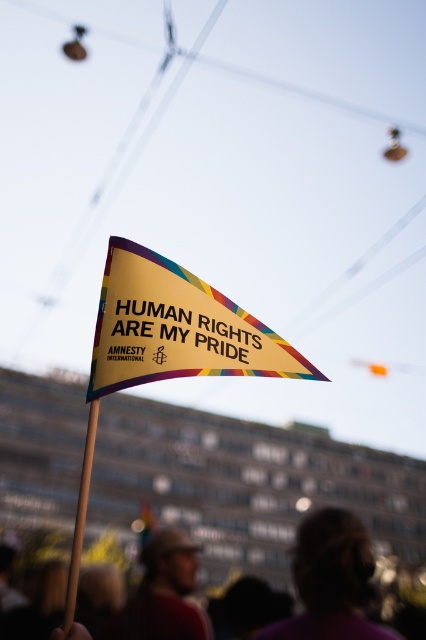
Can you confirm if purple fabric hair at lower center is positioned below brown fabric cap at lower center?

Incorrect, purple fabric hair at lower center is not positioned below brown fabric cap at lower center.

I want to click on purple fabric hair at lower center, so click(x=331, y=580).

Is gold metallic pennant at center to the left of blurred fabric crowd at lower center from the viewer's perspective?

Correct, you'll find gold metallic pennant at center to the left of blurred fabric crowd at lower center.

Is point (232, 358) more distant than point (351, 529)?

That is False.

Is point (135, 260) positioned after point (331, 552)?

No, (135, 260) is closer to viewer.

Identify the location of gold metallic pennant at center. The image size is (426, 640). (176, 326).

Is point (138, 332) positioned in front of point (158, 592)?

Yes.

Identify the location of gold metallic pennant at center. The height and width of the screenshot is (640, 426). (x=176, y=326).

Does point (141, 289) lie in front of point (181, 621)?

Yes.

Image resolution: width=426 pixels, height=640 pixels. I want to click on gold metallic pennant at center, so click(176, 326).